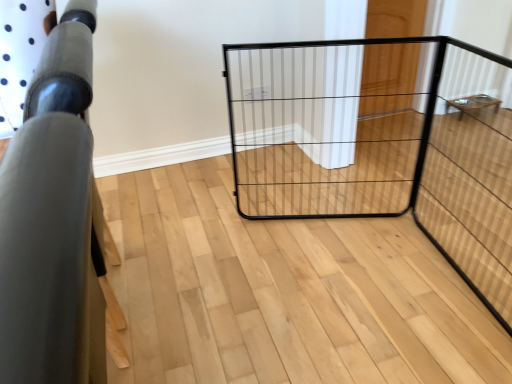
This screenshot has width=512, height=384. I want to click on free location in front of black wire cage at center, so click(x=361, y=290).